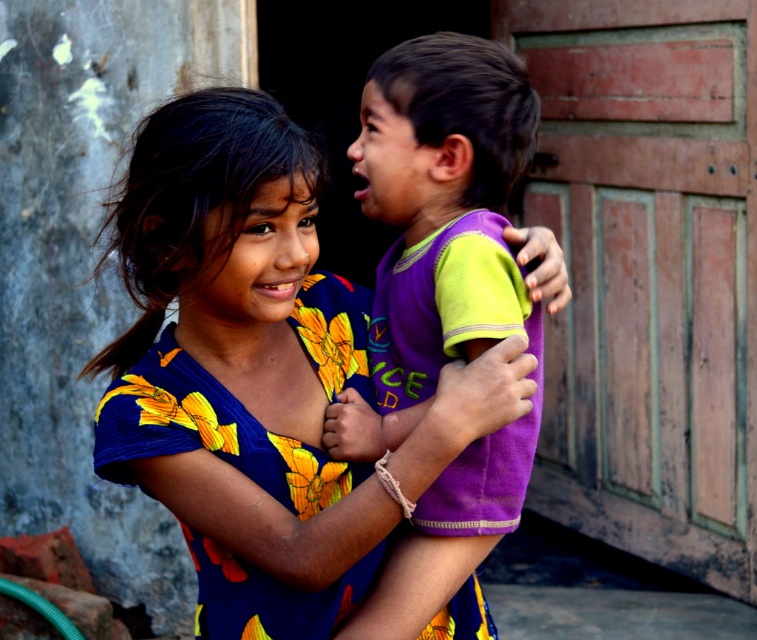
Question: Is floral fabric dress at center to the right of purple soft fabric shirt at center from the viewer's perspective?

Choices:
 (A) yes
 (B) no

Answer: (B)

Question: From the image, what is the correct spatial relationship of floral fabric dress at center in relation to purple soft fabric shirt at center?

Choices:
 (A) right
 (B) left

Answer: (B)

Question: From the image, what is the correct spatial relationship of floral fabric dress at center in relation to purple soft fabric shirt at center?

Choices:
 (A) left
 (B) right

Answer: (A)

Question: Which object appears farthest from the camera in this image?

Choices:
 (A) floral fabric dress at center
 (B) purple soft fabric shirt at center

Answer: (B)